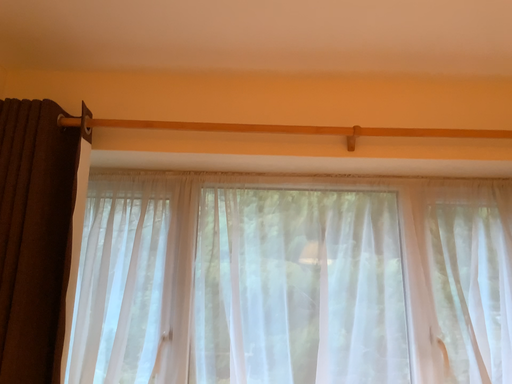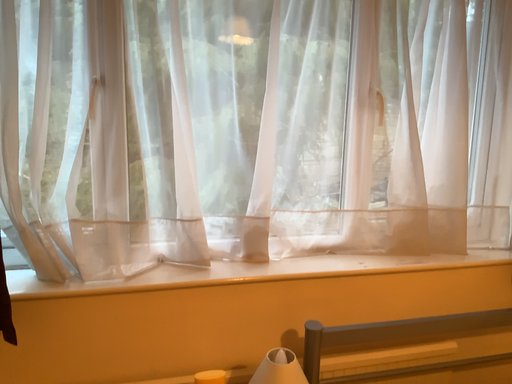
Question: How did the camera likely rotate when shooting the video?

Choices:
 (A) rotated upward
 (B) rotated downward

Answer: (B)